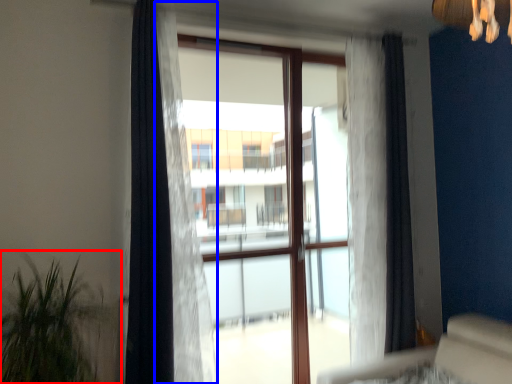
Question: Which point is closer to the camera, houseplant (highlighted by a red box) or curtain (highlighted by a blue box)?

Choices:
 (A) houseplant
 (B) curtain

Answer: (A)